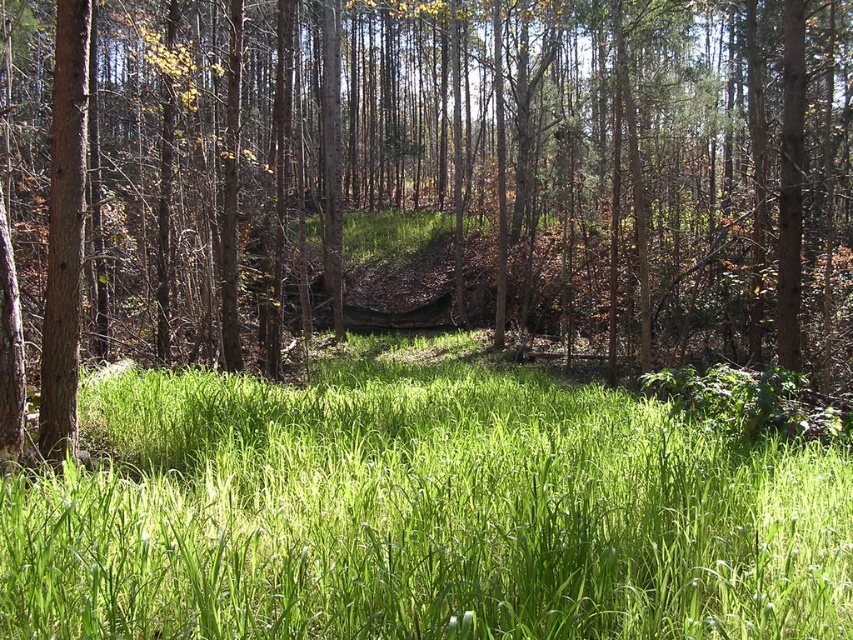
Question: Which point is farther from the camera taking this photo?

Choices:
 (A) (548, 564)
 (B) (825, 1)

Answer: (B)

Question: Which of the following is the farthest from the observer?

Choices:
 (A) brown wood tree at center
 (B) green grassy at center

Answer: (A)

Question: Is brown wood tree at center positioned in front of green grassy at center?

Choices:
 (A) no
 (B) yes

Answer: (A)

Question: From the image, what is the correct spatial relationship of brown wood tree at center in relation to green grassy at center?

Choices:
 (A) below
 (B) above

Answer: (B)

Question: Does brown wood tree at center appear over green grassy at center?

Choices:
 (A) yes
 (B) no

Answer: (A)